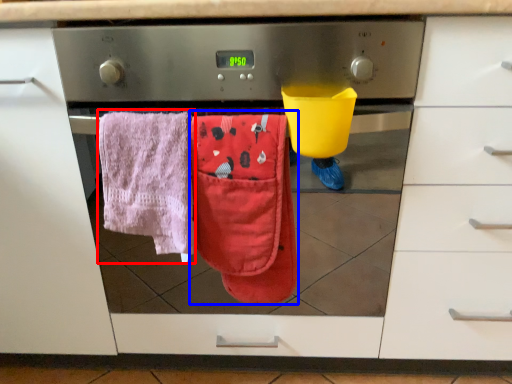
Question: Which object appears farthest to the camera in this image, beach towel (highlighted by a red box) or beach towel (highlighted by a blue box)?

Choices:
 (A) beach towel
 (B) beach towel

Answer: (B)